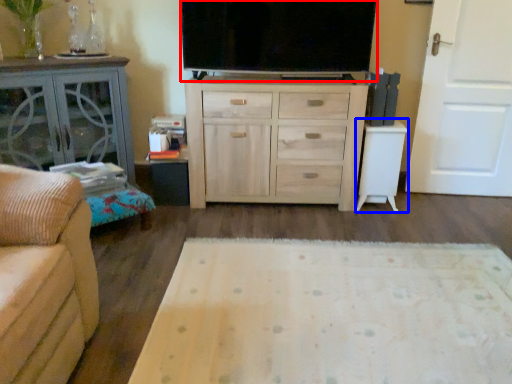
Question: Which of the following is the closest to the observer, television (highlighted by a red box) or table (highlighted by a blue box)?

Choices:
 (A) television
 (B) table

Answer: (A)